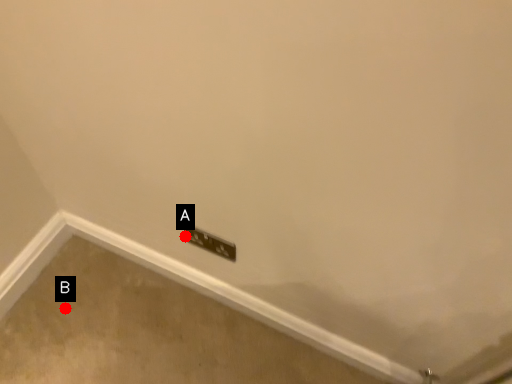
Question: Two points are circled on the image, labeled by A and B beside each circle. Which point is closer to the camera taking this photo?

Choices:
 (A) A is closer
 (B) B is closer

Answer: (A)